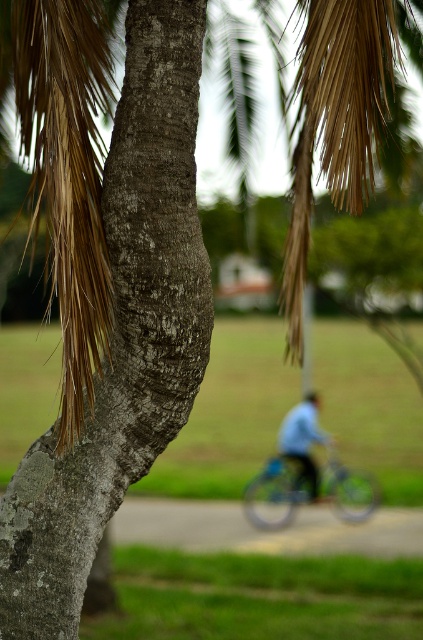
Between point (307, 481) and point (294, 412), which one is positioned in front?

Positioned in front is point (307, 481).

Based on the photo, is metallic blue bicycle at center bigger than blue matte shirt at center?

Yes.

Between point (255, 513) and point (302, 403), which one is positioned behind?

The point (302, 403) is more distant.

Locate an element on the screen. Image resolution: width=423 pixels, height=640 pixels. metallic blue bicycle at center is located at coordinates (275, 493).